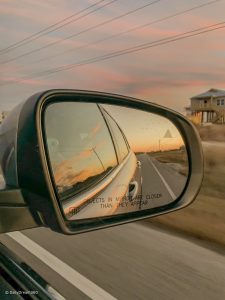
Locate an element on the screen. window is located at coordinates (96, 148).